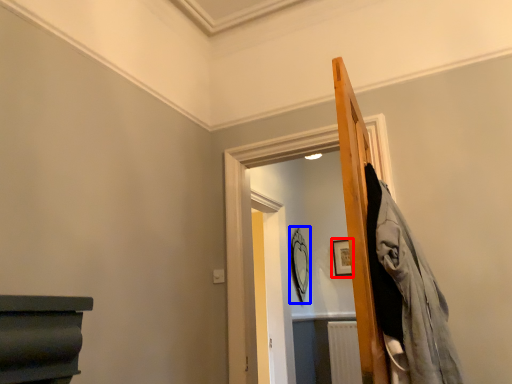
Question: Which object is closer to the camera taking this photo, picture frame (highlighted by a red box) or mirror (highlighted by a blue box)?

Choices:
 (A) picture frame
 (B) mirror

Answer: (B)